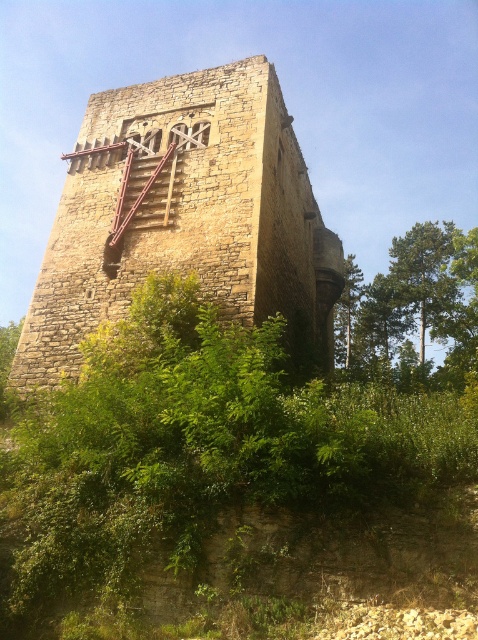
Question: Considering the relative positions of green leafy bush at center and stone tower at center in the image provided, where is green leafy bush at center located with respect to stone tower at center?

Choices:
 (A) left
 (B) right

Answer: (A)

Question: Which of the following is the farthest from the observer?

Choices:
 (A) stone tower at center
 (B) green leafy bush at center
 (C) green leafy tree at center
 (D) green leafy tree at right

Answer: (C)

Question: Does green leafy tree at right have a larger size compared to green leafy tree at center?

Choices:
 (A) no
 (B) yes

Answer: (B)

Question: Which of the following is the farthest from the observer?

Choices:
 (A) (467, 314)
 (B) (206, 314)
 (C) (344, 336)

Answer: (C)

Question: Can you confirm if green leafy bush at center is bigger than stone tower at center?

Choices:
 (A) no
 (B) yes

Answer: (A)

Question: Which object appears closest to the camera in this image?

Choices:
 (A) green leafy tree at center
 (B) green leafy tree at right
 (C) stone tower at center

Answer: (C)